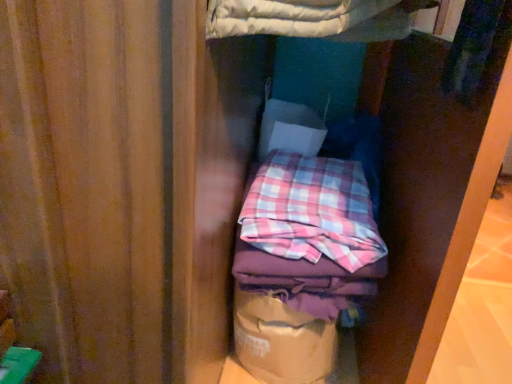
Question: Does pink plaid fabric at center lie behind brown paper bag at center?

Choices:
 (A) yes
 (B) no

Answer: (B)

Question: Is pink plaid fabric at center oriented away from brown paper bag at center?

Choices:
 (A) yes
 (B) no

Answer: (B)

Question: Is pink plaid fabric at center closer to camera compared to brown paper bag at center?

Choices:
 (A) no
 (B) yes

Answer: (B)

Question: Is pink plaid fabric at center to the right of brown paper bag at center from the viewer's perspective?

Choices:
 (A) no
 (B) yes

Answer: (B)

Question: Is pink plaid fabric at center located outside brown paper bag at center?

Choices:
 (A) no
 (B) yes

Answer: (B)

Question: Can brown paper bag at center be found inside pink plaid fabric at center?

Choices:
 (A) yes
 (B) no

Answer: (B)

Question: From a real-world perspective, does brown paper bag at center sit lower than pink plaid fabric at center?

Choices:
 (A) yes
 (B) no

Answer: (A)

Question: From a real-world perspective, is brown paper bag at center located higher than pink plaid fabric at center?

Choices:
 (A) no
 (B) yes

Answer: (A)

Question: Is brown paper bag at center taller than pink plaid fabric at center?

Choices:
 (A) no
 (B) yes

Answer: (B)

Question: Is brown paper bag at center outside of pink plaid fabric at center?

Choices:
 (A) no
 (B) yes

Answer: (B)

Question: Considering the relative sizes of brown paper bag at center and pink plaid fabric at center in the image provided, is brown paper bag at center thinner than pink plaid fabric at center?

Choices:
 (A) no
 (B) yes

Answer: (B)

Question: Can you confirm if brown paper bag at center is shorter than pink plaid fabric at center?

Choices:
 (A) yes
 (B) no

Answer: (B)

Question: From their relative heights in the image, would you say pink plaid fabric at center is taller or shorter than brown paper bag at center?

Choices:
 (A) tall
 (B) short

Answer: (B)